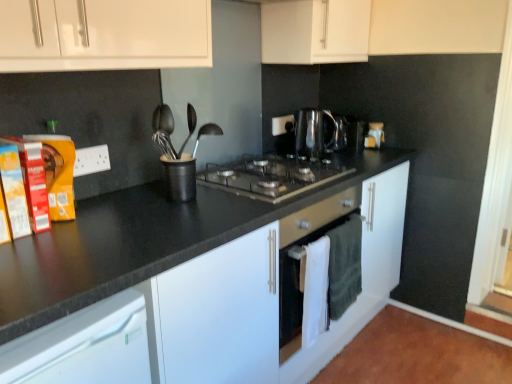
Question: Is black granite countertop at center inside or outside of shiny metallic kettle at center?

Choices:
 (A) inside
 (B) outside

Answer: (B)

Question: Visually, is black granite countertop at center positioned to the left or to the right of shiny metallic kettle at center?

Choices:
 (A) left
 (B) right

Answer: (A)

Question: Considering the real-world distances, which object is farthest from the black granite countertop at center?

Choices:
 (A) black glass gas stove at center
 (B) white matte cabinet at upper center
 (C) shiny metallic kettle at center
 (D) black matte utensil holder at center

Answer: (B)

Question: Estimate the real-world distances between objects in this image. Which object is closer to the black granite countertop at center?

Choices:
 (A) black glass gas stove at center
 (B) white matte cabinet at upper center
 (C) shiny metallic kettle at center
 (D) black matte utensil holder at center

Answer: (A)